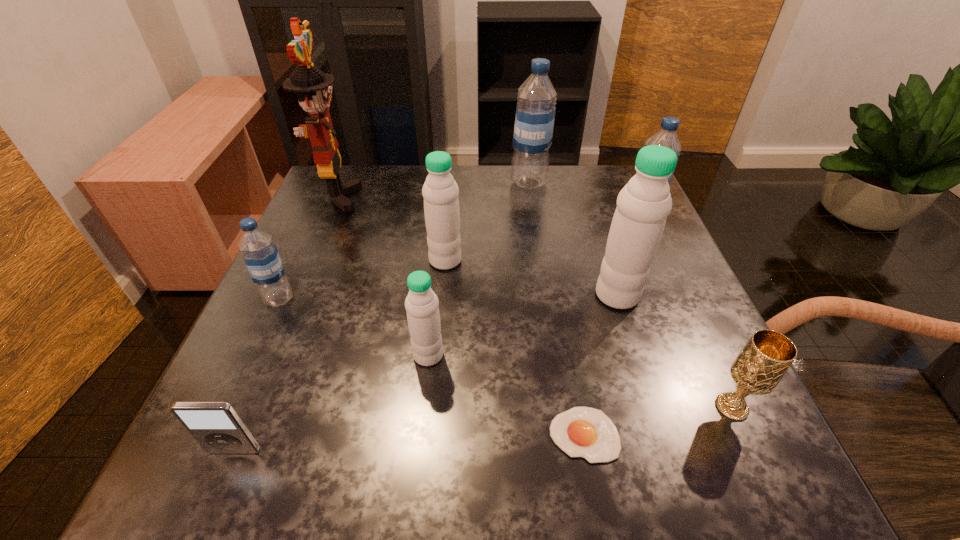
Identify the location of the tallest object. (313, 87).

The height and width of the screenshot is (540, 960). What are the coordinates of `the second blue water bottle from right to left` in the screenshot? It's located at (535, 113).

Image resolution: width=960 pixels, height=540 pixels. I want to click on the biggest blue water bottle, so click(535, 113).

Identify the location of the second nearest white water bottle. The width and height of the screenshot is (960, 540). (644, 203).

Where is `the second water bottle from right to left`? the second water bottle from right to left is located at coordinates (644, 203).

You are a GUI agent. You are given a task and a screenshot of the screen. Output one action in this format:
    pyautogui.click(x=<x>, y=<y>)
    Task: Click on the seventh nearest object
    The width and height of the screenshot is (960, 540).
    Given the screenshot: What is the action you would take?
    (x=440, y=191)

Image resolution: width=960 pixels, height=540 pixels. I want to click on the fourth nearest water bottle, so click(440, 191).

Image resolution: width=960 pixels, height=540 pixels. I want to click on the fifth nearest water bottle, so click(666, 136).

Find the location of a particular element. the rightmost water bottle is located at coordinates (666, 136).

This screenshot has width=960, height=540. I want to click on the fourth nearest object, so click(423, 317).